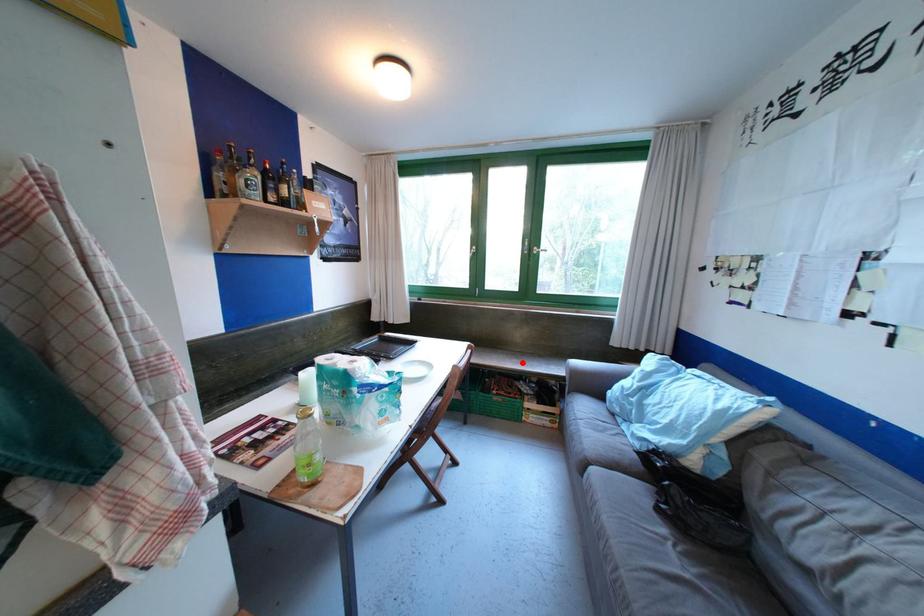
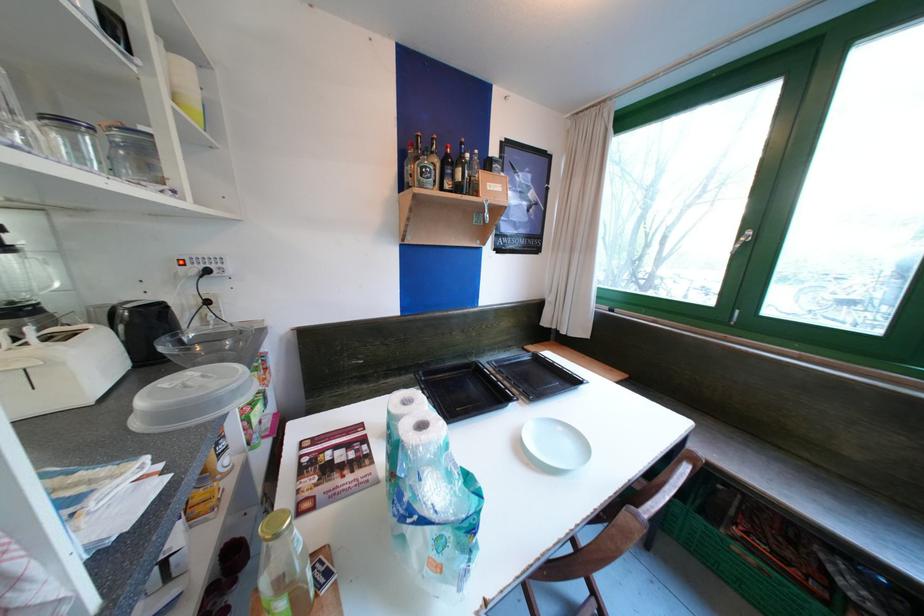
Question: I am providing you with two images of the same scene from different viewpoints. A red point is marked on the first image. At the location where the point appears in image 1, is it still visible in image 2?

Choices:
 (A) Yes
 (B) No

Answer: (A)